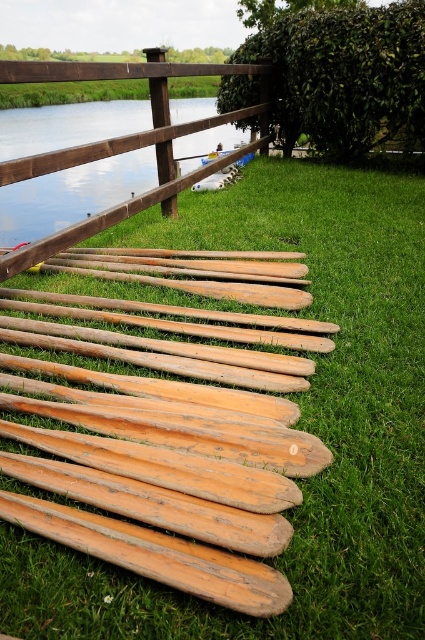
Question: Estimate the real-world distances between objects in this image. Which object is closer to the wooden canoe at center?

Choices:
 (A) green leafy hedge at upper center
 (B) light brown wooden oar at center
 (C) light brown wooden oar at lower left
 (D) smooth brown water at upper left

Answer: (A)

Question: Does smooth brown water at upper left appear under wooden canoe at center?

Choices:
 (A) no
 (B) yes

Answer: (A)

Question: Which point appears closest to the camera in this image?

Choices:
 (A) (212, 152)
 (B) (121, 544)
 (C) (274, 540)

Answer: (C)

Question: Is light brown wooden oar at center to the right of wooden canoe at center from the viewer's perspective?

Choices:
 (A) no
 (B) yes

Answer: (A)

Question: Among these points, which one is farthest from the camera?

Choices:
 (A) (135, 148)
 (B) (260, 545)
 (C) (234, 164)

Answer: (C)

Question: In this image, where is green leafy hedge at upper center located relative to wooden oar at center?

Choices:
 (A) below
 (B) above

Answer: (B)